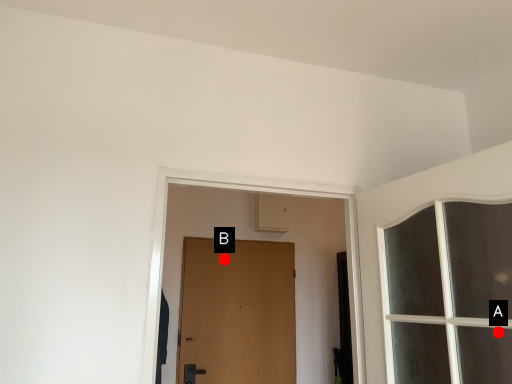
Question: Two points are circled on the image, labeled by A and B beside each circle. Which point appears farthest from the camera in this image?

Choices:
 (A) A is further
 (B) B is further

Answer: (B)